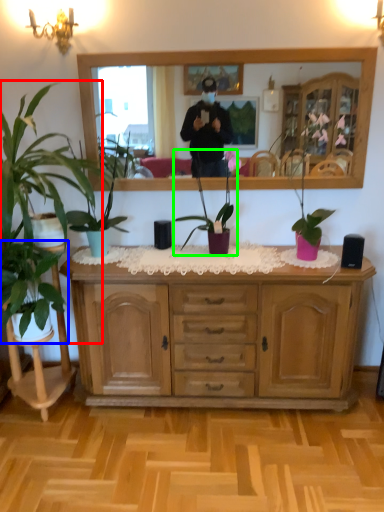
Question: Based on their relative distances, which object is nearer to houseplant (highlighted by a red box)? Choose from houseplant (highlighted by a blue box) and houseplant (highlighted by a green box).

Choices:
 (A) houseplant
 (B) houseplant

Answer: (A)